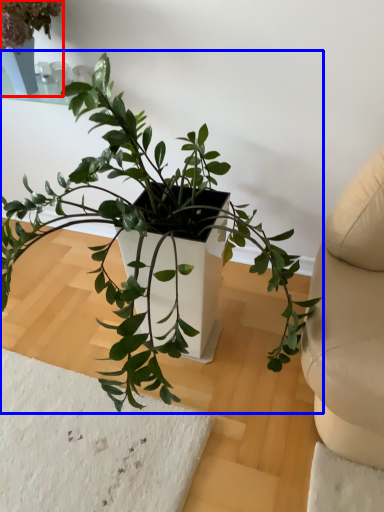
Question: Which object appears farthest to the camera in this image, houseplant (highlighted by a red box) or houseplant (highlighted by a blue box)?

Choices:
 (A) houseplant
 (B) houseplant

Answer: (A)